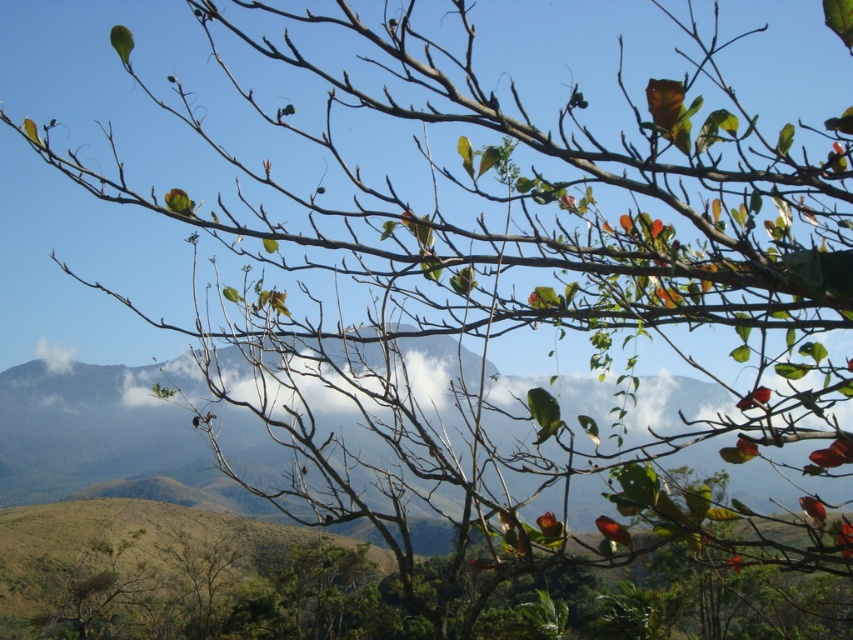
You are an astronomer observing the sky in the image. You notice a point labeled with coordinates. What object is located at point (354, 364)?

The point at (354, 364) marks a white fluffy cloud at center.